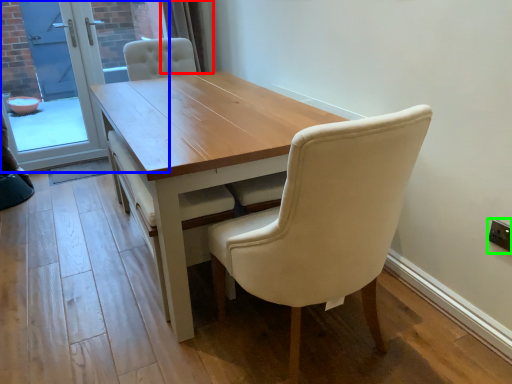
Question: Which object is the farthest from curtain (highlighted by a red box)? Choose among these: screen door (highlighted by a blue box) or electric outlet (highlighted by a green box).

Choices:
 (A) screen door
 (B) electric outlet

Answer: (B)